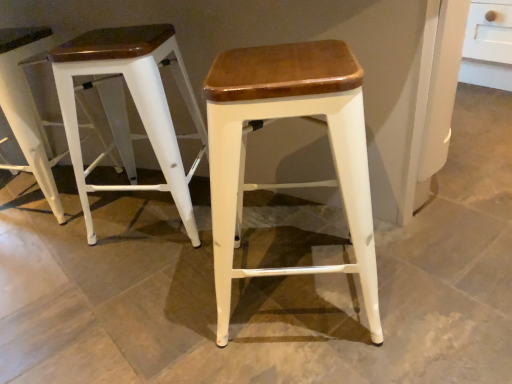
At what (x,y) coordinates should I click in order to perform the action: click on white wood stool at center, the 1th stool viewed from the right. Please return your answer as a coordinate pair (x, y). Looking at the image, I should click on (x=287, y=183).

The height and width of the screenshot is (384, 512). Describe the element at coordinates (28, 109) in the screenshot. I see `white matte stool at left, which is the 1th stool from left to right` at that location.

This screenshot has width=512, height=384. What are the coordinates of `white wood stool at center, the 1th stool viewed from the right` in the screenshot? It's located at (287, 183).

How far apart are white matte stool at left, acting as the 3th stool starting from the right, and white matte stool at left, which is counted as the 2th stool, starting from the right?

11.48 inches.

Starting from the white matte stool at left, acting as the 3th stool starting from the right, which stool is the 1st one in front? Please provide its 2D coordinates.

[(125, 107)]

Consider the image. Who is smaller, white matte stool at left, acting as the 3th stool starting from the right, or white matte stool at left, which is counted as the second stool, starting from the left?

Smaller between the two is white matte stool at left, acting as the 3th stool starting from the right.

Considering the sizes of white matte stool at left, which is the 1th stool from left to right, and white matte stool at left, which is counted as the 2th stool, starting from the right, in the image, is white matte stool at left, which is the 1th stool from left to right, taller or shorter than white matte stool at left, which is counted as the 2th stool, starting from the right,?

Considering their sizes, white matte stool at left, which is the 1th stool from left to right, has more height than white matte stool at left, which is counted as the 2th stool, starting from the right.

Could you tell me if white wood stool at center, the 1th stool viewed from the right, is turned towards white matte stool at left, which is the 1th stool from left to right?

No.

Would you say white matte stool at left, acting as the 3th stool starting from the right, is part of white wood stool at center, the 1th stool viewed from the right,'s contents?

No.

From the image's perspective, count 2nd stools upward from the white wood stool at center, the 1th stool viewed from the right, and point to it. Please provide its 2D coordinates.

[(28, 109)]

Relative to white matte stool at left, acting as the 3th stool starting from the right, is white wood stool at center, the third stool when ordered from left to right, in front or behind?

Clearly, white wood stool at center, the third stool when ordered from left to right, is in front of white matte stool at left, acting as the 3th stool starting from the right.

From the image's perspective, is white matte stool at left, which is counted as the 2th stool, starting from the right, on top of white wood stool at center, the third stool when ordered from left to right?

Indeed, from the image's perspective, white matte stool at left, which is counted as the 2th stool, starting from the right, is shown above white wood stool at center, the third stool when ordered from left to right.

Does white matte stool at left, which is counted as the 2th stool, starting from the right, have a lesser height compared to white wood stool at center, the 1th stool viewed from the right?

Yes, white matte stool at left, which is counted as the 2th stool, starting from the right, is shorter than white wood stool at center, the 1th stool viewed from the right.

Is point (61, 67) positioned behind point (275, 115)?

Yes, point (61, 67) is behind point (275, 115).

Would you say white matte stool at left, which is counted as the second stool, starting from the left, is outside white wood stool at center, the 1th stool viewed from the right?

Yes, white matte stool at left, which is counted as the second stool, starting from the left, is located beyond the bounds of white wood stool at center, the 1th stool viewed from the right.

Which of these two, white matte stool at left, which is counted as the second stool, starting from the left, or white matte stool at left, which is the 1th stool from left to right, stands taller?

white matte stool at left, which is the 1th stool from left to right, is taller.

From the image's perspective, relative to white matte stool at left, acting as the 3th stool starting from the right, is white matte stool at left, which is counted as the second stool, starting from the left, above or below?

white matte stool at left, which is counted as the second stool, starting from the left, is below white matte stool at left, acting as the 3th stool starting from the right.

Is white matte stool at left, which is counted as the second stool, starting from the left, positioned with its back to white matte stool at left, acting as the 3th stool starting from the right?

white matte stool at left, which is counted as the second stool, starting from the left, does not have its back to white matte stool at left, acting as the 3th stool starting from the right.

Which of these two, white matte stool at left, which is the 1th stool from left to right, or white wood stool at center, the third stool when ordered from left to right, stands shorter?

white wood stool at center, the third stool when ordered from left to right, is shorter.

Which is behind, white matte stool at left, acting as the 3th stool starting from the right, or white wood stool at center, the 1th stool viewed from the right?

white matte stool at left, acting as the 3th stool starting from the right, is further from the camera.

Is white matte stool at left, which is the 1th stool from left to right, far away from white wood stool at center, the 1th stool viewed from the right?

That's not correct — white matte stool at left, which is the 1th stool from left to right, is a little close to white wood stool at center, the 1th stool viewed from the right.

Considering their positions, is white wood stool at center, the 1th stool viewed from the right, located in front of or behind white matte stool at left, which is counted as the 2th stool, starting from the right?

Clearly, white wood stool at center, the 1th stool viewed from the right, is in front of white matte stool at left, which is counted as the 2th stool, starting from the right.

From the image's perspective, which is below, white wood stool at center, the third stool when ordered from left to right, or white matte stool at left, which is counted as the 2th stool, starting from the right?

From the image's view, white wood stool at center, the third stool when ordered from left to right, is below.

Considering the sizes of white wood stool at center, the 1th stool viewed from the right, and white matte stool at left, which is counted as the 2th stool, starting from the right, in the image, is white wood stool at center, the 1th stool viewed from the right, taller or shorter than white matte stool at left, which is counted as the 2th stool, starting from the right,?

Clearly, white wood stool at center, the 1th stool viewed from the right, is taller compared to white matte stool at left, which is counted as the 2th stool, starting from the right.

Is white matte stool at left, which is counted as the second stool, starting from the left, at the back of white wood stool at center, the 1th stool viewed from the right?

That's not correct — white wood stool at center, the 1th stool viewed from the right, is not looking away from white matte stool at left, which is counted as the second stool, starting from the left.

There is a white matte stool at left, which is counted as the 2th stool, starting from the right. Where is `the 1st stool above it (from a real-world perspective)`? This screenshot has width=512, height=384. the 1st stool above it (from a real-world perspective) is located at coordinates (28, 109).

I want to click on the 2nd stool to the right when counting from the white matte stool at left, which is the 1th stool from left to right, so click(x=287, y=183).

Based on their spatial positions, is white wood stool at center, the third stool when ordered from left to right, or white matte stool at left, which is the 1th stool from left to right, further from white matte stool at left, which is counted as the second stool, starting from the left?

Among the two, white wood stool at center, the third stool when ordered from left to right, is located further to white matte stool at left, which is counted as the second stool, starting from the left.

Estimate the real-world distances between objects in this image. Which object is further from white wood stool at center, the third stool when ordered from left to right, white matte stool at left, acting as the 3th stool starting from the right, or white matte stool at left, which is counted as the 2th stool, starting from the right?

Based on the image, white matte stool at left, acting as the 3th stool starting from the right, appears to be further to white wood stool at center, the third stool when ordered from left to right.

Considering their positions, is white wood stool at center, the 1th stool viewed from the right, positioned further to white matte stool at left, which is the 1th stool from left to right, than white matte stool at left, which is counted as the second stool, starting from the left?

white wood stool at center, the 1th stool viewed from the right, lies further to white matte stool at left, which is the 1th stool from left to right, than the other object.

Estimate the real-world distances between objects in this image. Which object is closer to white matte stool at left, acting as the 3th stool starting from the right, white matte stool at left, which is counted as the second stool, starting from the left, or white wood stool at center, the third stool when ordered from left to right?

white matte stool at left, which is counted as the second stool, starting from the left.

Considering their positions, is white matte stool at left, which is the 1th stool from left to right, positioned closer to white matte stool at left, which is counted as the 2th stool, starting from the right, than white wood stool at center, the 1th stool viewed from the right?

white matte stool at left, which is the 1th stool from left to right, is closer to white matte stool at left, which is counted as the 2th stool, starting from the right.

Considering their positions, is white matte stool at left, which is counted as the 2th stool, starting from the right, positioned closer to white wood stool at center, the third stool when ordered from left to right, than white matte stool at left, which is the 1th stool from left to right?

white matte stool at left, which is counted as the 2th stool, starting from the right.

In order to click on stool between white matte stool at left, which is the 1th stool from left to right, and white wood stool at center, the 1th stool viewed from the right in this screenshot , I will do `click(125, 107)`.